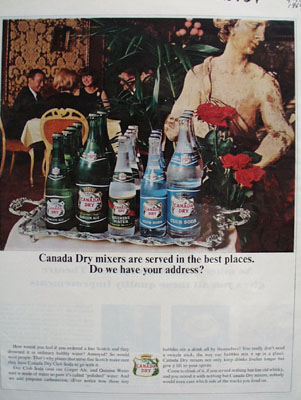
At what (x,y) coordinates should I click in order to perform the action: click on tablecloth. Please return your answer as a coordinate pair (x, y). This screenshot has height=400, width=301. Looking at the image, I should click on (36, 128).